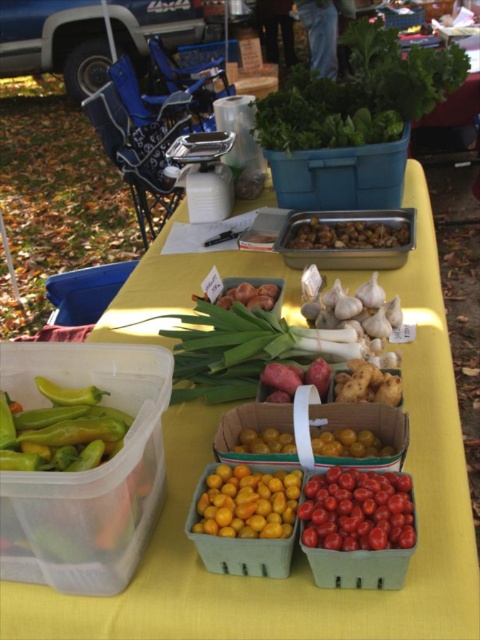
Question: Among these objects, which one is farthest from the camera?

Choices:
 (A) yellow matte tomatoes at center
 (B) shiny red tomatoes at center

Answer: (A)

Question: Does green leafy at upper center appear on the left side of yellow matte cherry tomatoes at center?

Choices:
 (A) no
 (B) yes

Answer: (A)

Question: Is yellow matte tomatoes at center above brown matte nuts at center?

Choices:
 (A) yes
 (B) no

Answer: (B)

Question: Considering the real-world distances, which object is closest to the green leafy at upper center?

Choices:
 (A) green matte peppers at center-left
 (B) shiny red tomatoes at center
 (C) brown matte nuts at center
 (D) yellow matte tomatoes at center

Answer: (C)

Question: Is green matte peppers at center-left above brown matte nuts at center?

Choices:
 (A) no
 (B) yes

Answer: (A)

Question: Based on their relative distances, which object is farther from the green leafy at upper center?

Choices:
 (A) yellow matte cherry tomatoes at center
 (B) yellow matte tomatoes at center
 (C) green matte peppers at center-left
 (D) shiny red tomatoes at center

Answer: (B)